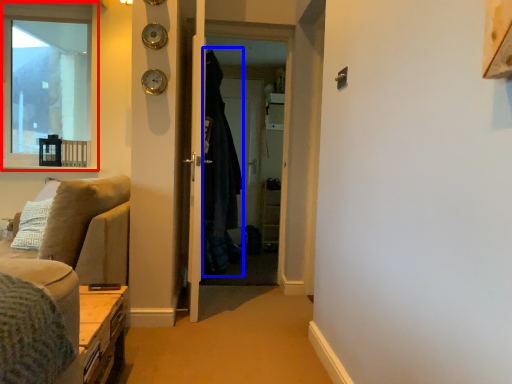
Question: Which object is closer to the camera taking this photo, window (highlighted by a red box) or robe (highlighted by a blue box)?

Choices:
 (A) window
 (B) robe

Answer: (B)